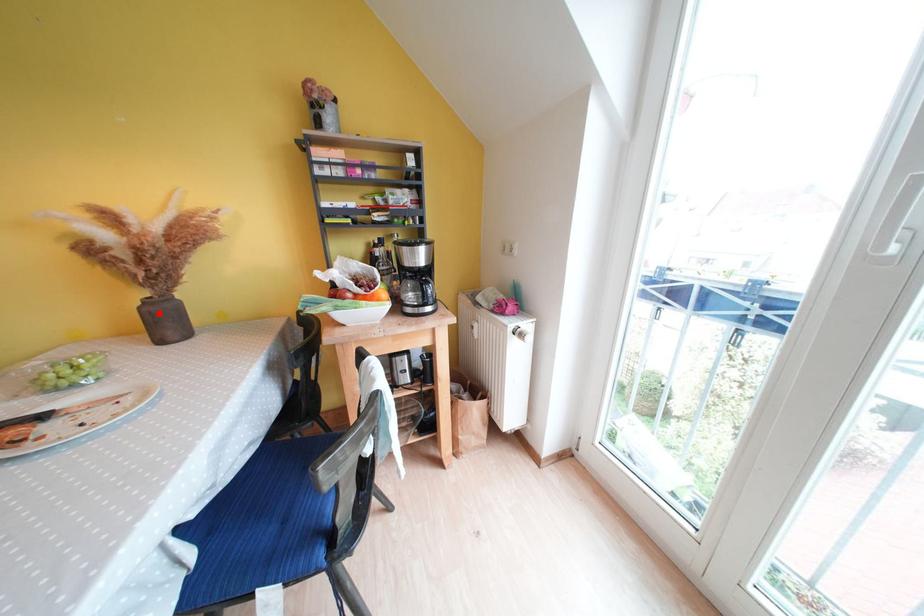
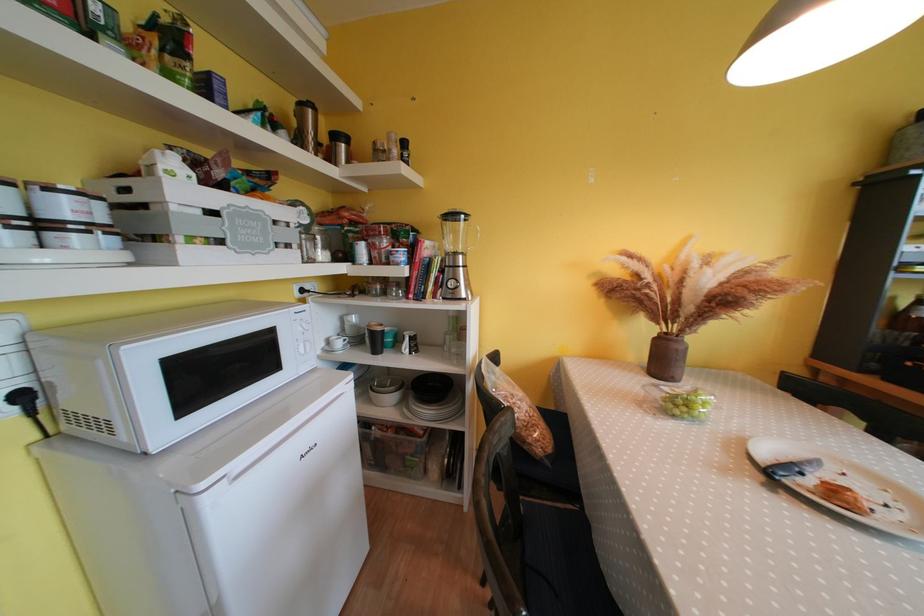
Locate, in the second image, the point that corresponds to the highlighted location in the first image.

(687, 351)